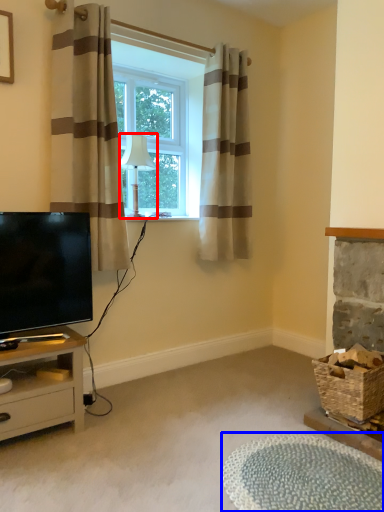
Question: Among these objects, which one is nearest to the camera, lamp (highlighted by a red box) or plain (highlighted by a blue box)?

Choices:
 (A) lamp
 (B) plain

Answer: (B)